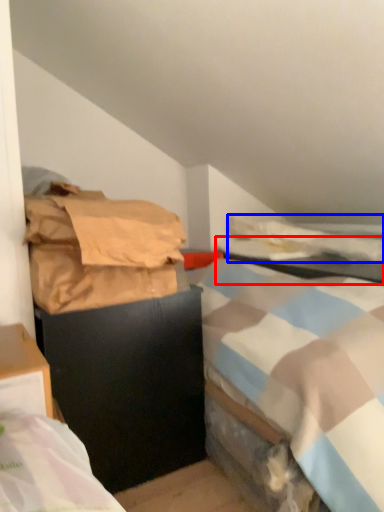
Question: Which of the following is the closest to the observer, table (highlighted by a red box) or blanket (highlighted by a blue box)?

Choices:
 (A) table
 (B) blanket

Answer: (A)